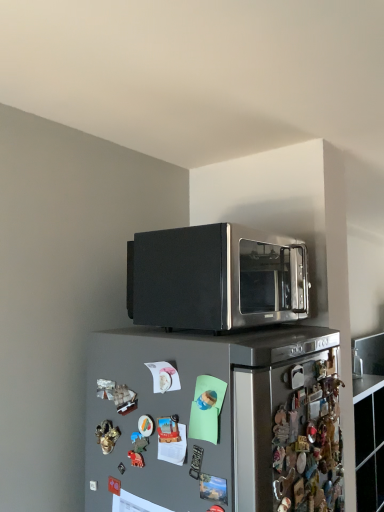
Measure the distance between satin silver refrigerator at upper center and camera.

Answer: The depth of satin silver refrigerator at upper center is 39.33 inches.

Where is `satin silver refrigerator at upper center`? Image resolution: width=384 pixels, height=512 pixels. satin silver refrigerator at upper center is located at coordinates (213, 421).

What do you see at coordinates (213, 421) in the screenshot?
I see `satin silver refrigerator at upper center` at bounding box center [213, 421].

You are a GUI agent. You are given a task and a screenshot of the screen. Output one action in this format:
    pyautogui.click(x=<x>, y=<y>)
    Task: Click on the satin black microwave at upper center
    This screenshot has width=384, height=512.
    Given the screenshot: What is the action you would take?
    pyautogui.click(x=216, y=278)

Describe the element at coordinates (216, 278) in the screenshot. The height and width of the screenshot is (512, 384). I see `satin black microwave at upper center` at that location.

The height and width of the screenshot is (512, 384). Identify the location of satin silver refrigerator at upper center. (213, 421).

Considering the positions of objects satin silver refrigerator at upper center and satin black microwave at upper center in the image provided, who is more to the right, satin silver refrigerator at upper center or satin black microwave at upper center?

satin black microwave at upper center.

Is satin silver refrigerator at upper center behind satin black microwave at upper center?

No, the depth of satin silver refrigerator at upper center is less than that of satin black microwave at upper center.

Is point (158, 439) positioned before point (176, 305)?

Yes, it is in front of point (176, 305).

From the image's perspective, relative to satin black microwave at upper center, is satin silver refrigerator at upper center above or below?

satin silver refrigerator at upper center is situated lower than satin black microwave at upper center in the image.

From a real-world perspective, is satin silver refrigerator at upper center physically located above or below satin black microwave at upper center?

From a real-world perspective, satin silver refrigerator at upper center is physically below satin black microwave at upper center.

Which of these two, satin silver refrigerator at upper center or satin black microwave at upper center, is wider?

Wider between the two is satin silver refrigerator at upper center.

Considering the sizes of objects satin silver refrigerator at upper center and satin black microwave at upper center in the image provided, who is shorter, satin silver refrigerator at upper center or satin black microwave at upper center?

satin black microwave at upper center is shorter.

Which of these two, satin silver refrigerator at upper center or satin black microwave at upper center, is smaller?

With smaller size is satin black microwave at upper center.

Is satin silver refrigerator at upper center not within satin black microwave at upper center?

Yes, satin silver refrigerator at upper center is outside of satin black microwave at upper center.

Is satin silver refrigerator at upper center in contact with satin black microwave at upper center?

They are not placed beside each other.

Is satin silver refrigerator at upper center oriented away from satin black microwave at upper center?

satin silver refrigerator at upper center is not turned away from satin black microwave at upper center.

How far apart are satin silver refrigerator at upper center and satin black microwave at upper center?

9.40 inches.

Where is `microwave oven on the right of satin silver refrigerator at upper center`? The height and width of the screenshot is (512, 384). microwave oven on the right of satin silver refrigerator at upper center is located at coordinates (216, 278).

Considering the relative positions of satin black microwave at upper center and satin silver refrigerator at upper center in the image provided, is satin black microwave at upper center to the left or to the right of satin silver refrigerator at upper center?

Clearly, satin black microwave at upper center is on the right of satin silver refrigerator at upper center in the image.

Consider the image. Which object is further away from the camera taking this photo, satin black microwave at upper center or satin silver refrigerator at upper center?

satin black microwave at upper center is further away from the camera.

Which is farther, (268, 273) or (158, 407)?

The point (268, 273) is more distant.

From the image's perspective, does satin black microwave at upper center appear higher than satin silver refrigerator at upper center?

Yes, from the image's perspective, satin black microwave at upper center is over satin silver refrigerator at upper center.

From a real-world perspective, between satin black microwave at upper center and satin silver refrigerator at upper center, who is vertically lower?

satin silver refrigerator at upper center, from a real-world perspective.

Which of these two, satin black microwave at upper center or satin silver refrigerator at upper center, is wider?

satin silver refrigerator at upper center.

Which of these two, satin black microwave at upper center or satin silver refrigerator at upper center, stands shorter?

satin black microwave at upper center.

Can you confirm if satin black microwave at upper center is smaller than satin silver refrigerator at upper center?

Indeed, satin black microwave at upper center has a smaller size compared to satin silver refrigerator at upper center.

Can satin silver refrigerator at upper center be found inside satin black microwave at upper center?

No, satin silver refrigerator at upper center is not surrounded by satin black microwave at upper center.

Looking at this image, can you see satin black microwave at upper center touching satin silver refrigerator at upper center?

No, satin black microwave at upper center is not in contact with satin silver refrigerator at upper center.

Is satin black microwave at upper center facing away from satin silver refrigerator at upper center?

No, satin silver refrigerator at upper center is not at the back of satin black microwave at upper center.

This screenshot has width=384, height=512. In order to click on refrigerator lying below the satin black microwave at upper center (from the image's perspective) in this screenshot , I will do `click(213, 421)`.

The image size is (384, 512). What are the coordinates of `refrigerator below the satin black microwave at upper center (from the image's perspective)` in the screenshot? It's located at (213, 421).

Locate an element on the screen. refrigerator on the left of satin black microwave at upper center is located at coordinates (213, 421).